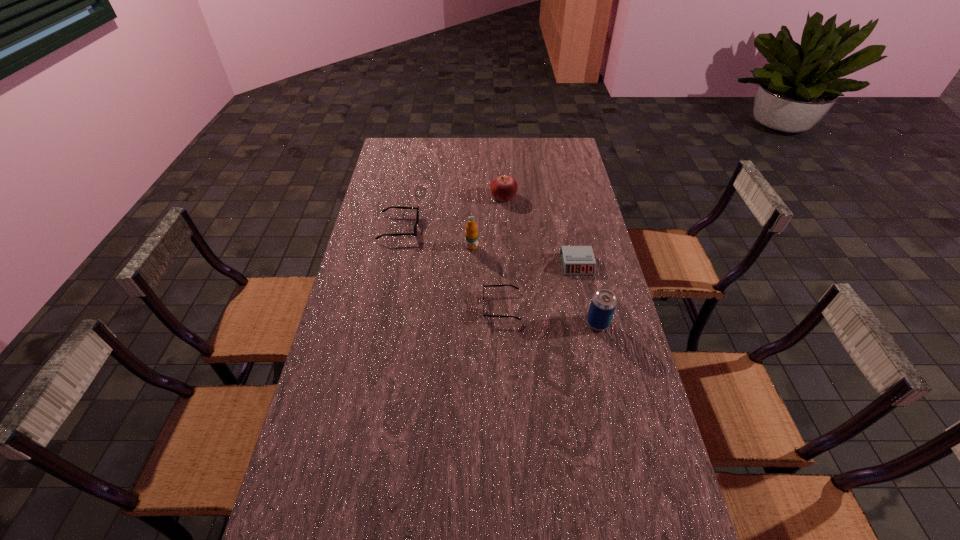
Where is `vacant region at the far edge of the desktop`? vacant region at the far edge of the desktop is located at coordinates (509, 145).

This screenshot has height=540, width=960. What are the coordinates of `free spot at the left edge of the desktop` in the screenshot? It's located at (388, 183).

Locate an element on the screen. free space at the right edge of the desktop is located at coordinates (627, 480).

Find the location of a particular element. free space at the far left corner of the desktop is located at coordinates (409, 144).

Image resolution: width=960 pixels, height=540 pixels. I want to click on empty location between the fourth farthest object and the farthest object, so click(540, 231).

Where is `free space between the shorter sunglasses and the farther sunglasses`? free space between the shorter sunglasses and the farther sunglasses is located at coordinates (450, 267).

In order to click on vacant point located between the shorter sunglasses and the beer can in this screenshot , I will do `click(550, 315)`.

What are the coordinates of `free space between the farther sunglasses and the second object from left to right` in the screenshot? It's located at (435, 237).

This screenshot has height=540, width=960. Find the location of `vacant region between the shorter sunglasses and the alarm clock`. vacant region between the shorter sunglasses and the alarm clock is located at coordinates (540, 285).

What are the coordinates of `vacant point located between the farthest object and the orange juice` in the screenshot? It's located at point(488,222).